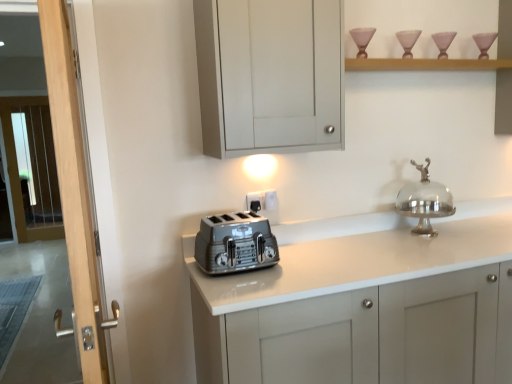
Describe the element at coordinates (255, 201) in the screenshot. I see `matte black outlet at center, the second electric outlet when ordered from right to left` at that location.

Locate an element on the screen. This screenshot has width=512, height=384. matte black outlet at center, the second electric outlet when ordered from right to left is located at coordinates (255, 201).

What is the approximate height of white glossy countertop at center?

The height of white glossy countertop at center is 39.06 inches.

Image resolution: width=512 pixels, height=384 pixels. What do you see at coordinates (360, 255) in the screenshot?
I see `white glossy countertop at center` at bounding box center [360, 255].

The height and width of the screenshot is (384, 512). Find the location of `white plastic electric outlet at center, marked as the 2th electric outlet in a left-to-right arrangement`. white plastic electric outlet at center, marked as the 2th electric outlet in a left-to-right arrangement is located at coordinates (271, 201).

Identify the location of wooden screen door at left, the second screen door in the back-to-front sequence. This screenshot has width=512, height=384. (75, 190).

Where is `matte black outlet at center, acting as the first electric outlet starting from the left`? The width and height of the screenshot is (512, 384). matte black outlet at center, acting as the first electric outlet starting from the left is located at coordinates (255, 201).

Looking at this image, from a real-world perspective, who is located higher, matte black outlet at center, acting as the first electric outlet starting from the left, or matte gray cabinet at upper center?

matte gray cabinet at upper center is physically above.

Can you tell me how much matte black outlet at center, acting as the first electric outlet starting from the left, and matte gray cabinet at upper center differ in facing direction?

The facing directions of matte black outlet at center, acting as the first electric outlet starting from the left, and matte gray cabinet at upper center are 0.00234 degrees apart.

Does point (255, 211) come behind point (319, 94)?

Yes.

Does matte black outlet at center, the second electric outlet when ordered from right to left, touch matte gray cabinet at upper center?

matte black outlet at center, the second electric outlet when ordered from right to left, is not next to matte gray cabinet at upper center, and they're not touching.

Is clear glass screen door at left, placed as the 1th screen door when sorted from left to right, looking in the opposite direction of white glossy countertop at center?

clear glass screen door at left, placed as the 1th screen door when sorted from left to right, is not turned away from white glossy countertop at center.

Looking at the image, does clear glass screen door at left, which is the 1th screen door in back-to-front order, seem bigger or smaller compared to white glossy countertop at center?

Clearly, clear glass screen door at left, which is the 1th screen door in back-to-front order, is smaller in size than white glossy countertop at center.

Consider the image. Does clear glass screen door at left, placed as the 1th screen door when sorted from left to right, have a lesser width compared to white glossy countertop at center?

Indeed, clear glass screen door at left, placed as the 1th screen door when sorted from left to right, has a lesser width compared to white glossy countertop at center.

Identify the location of screen door that appears behind the silver metallic cake stand at upper right. Image resolution: width=512 pixels, height=384 pixels. (33, 169).

Considering their positions, is silver metallic cake stand at upper right located in front of or behind clear glass screen door at left, the second screen door when ordered from right to left?

silver metallic cake stand at upper right is in front of clear glass screen door at left, the second screen door when ordered from right to left.

Is silver metallic cake stand at upper right directly adjacent to clear glass screen door at left, which is the 1th screen door in back-to-front order?

No.

In the image, is silver metallic cake stand at upper right on the left side or the right side of clear glass screen door at left, placed as the 1th screen door when sorted from left to right?

Based on their positions, silver metallic cake stand at upper right is located to the right of clear glass screen door at left, placed as the 1th screen door when sorted from left to right.

Considering the positions of objects satin silver toaster at center and matte gray cabinet at upper center in the image provided, who is in front, satin silver toaster at center or matte gray cabinet at upper center?

matte gray cabinet at upper center is in front.

Considering the relative sizes of satin silver toaster at center and matte gray cabinet at upper center in the image provided, is satin silver toaster at center shorter than matte gray cabinet at upper center?

Correct, satin silver toaster at center is not as tall as matte gray cabinet at upper center.

Identify the location of home appliance directly beneath the matte gray cabinet at upper center (from a real-world perspective). (234, 243).

Who is bigger, satin silver toaster at center or matte gray cabinet at upper center?

Bigger between the two is matte gray cabinet at upper center.

Could you measure the distance between wooden shelf at upper center and matte black outlet at center, the second electric outlet when ordered from right to left?

They are 3.29 feet apart.

From the picture: Can you confirm if wooden shelf at upper center is shorter than matte black outlet at center, the second electric outlet when ordered from right to left?

Correct, wooden shelf at upper center is not as tall as matte black outlet at center, the second electric outlet when ordered from right to left.

Which of these two, wooden shelf at upper center or matte black outlet at center, the second electric outlet when ordered from right to left, is thinner?

matte black outlet at center, the second electric outlet when ordered from right to left, is thinner.

Is satin silver toaster at center in front of or behind clear glass screen door at left, which is the 1th screen door in back-to-front order, in the image?

Visually, satin silver toaster at center is located in front of clear glass screen door at left, which is the 1th screen door in back-to-front order.

Image resolution: width=512 pixels, height=384 pixels. I want to click on screen door behind the satin silver toaster at center, so click(33, 169).

Is satin silver toaster at center inside the boundaries of clear glass screen door at left, the 2th screen door from the front, or outside?

satin silver toaster at center is spatially situated outside clear glass screen door at left, the 2th screen door from the front.

Is satin silver toaster at center thinner than clear glass screen door at left, which is the 1th screen door in back-to-front order?

In fact, satin silver toaster at center might be wider than clear glass screen door at left, which is the 1th screen door in back-to-front order.

From the image's perspective, is clear glass screen door at left, the 2th screen door from the front, on satin silver toaster at center?

Yes, from the image's perspective, clear glass screen door at left, the 2th screen door from the front, is above satin silver toaster at center.

Between clear glass screen door at left, placed as the 1th screen door when sorted from left to right, and satin silver toaster at center, which one is positioned in front?

satin silver toaster at center is more forward.

Is clear glass screen door at left, the 2th screen door from the front, oriented towards satin silver toaster at center?

No, clear glass screen door at left, the 2th screen door from the front, is not turned towards satin silver toaster at center.

Which electric outlet is the 2nd one when counting from the back of the matte gray cabinet at upper center? Please provide its 2D coordinates.

[(255, 201)]

Image resolution: width=512 pixels, height=384 pixels. Find the location of `countertop in front of the clear glass screen door at left, which is the 1th screen door in back-to-front order`. countertop in front of the clear glass screen door at left, which is the 1th screen door in back-to-front order is located at coordinates (360, 255).

Considering their positions, is silver metallic cake stand at upper right positioned further to white glossy countertop at center than wooden shelf at upper center?

wooden shelf at upper center.

Based on their spatial positions, is wooden shelf at upper center or clear glass screen door at left, the second screen door when ordered from right to left, further from matte gray cabinet at upper center?

The object further to matte gray cabinet at upper center is clear glass screen door at left, the second screen door when ordered from right to left.

Which object lies further to the anchor point wooden screen door at left, the second screen door in the back-to-front sequence, satin silver toaster at center or matte black outlet at center, the second electric outlet when ordered from right to left?

matte black outlet at center, the second electric outlet when ordered from right to left, lies further to wooden screen door at left, the second screen door in the back-to-front sequence, than the other object.

Estimate the real-world distances between objects in this image. Which object is further from wooden screen door at left, the second screen door from the left, white plastic electric outlet at center, marked as the 2th electric outlet in a left-to-right arrangement, or satin silver toaster at center?

white plastic electric outlet at center, marked as the 2th electric outlet in a left-to-right arrangement, is positioned further to the anchor wooden screen door at left, the second screen door from the left.

Which object lies nearer to the anchor point white glossy countertop at center, clear glass screen door at left, which is the 1th screen door in back-to-front order, or white plastic electric outlet at center, marked as the 1th electric outlet in a right-to-left arrangement?

The object closer to white glossy countertop at center is white plastic electric outlet at center, marked as the 1th electric outlet in a right-to-left arrangement.

Considering their positions, is matte gray cabinet at upper center positioned further to silver metallic cake stand at upper right than white plastic electric outlet at center, marked as the 2th electric outlet in a left-to-right arrangement?

Among the two, matte gray cabinet at upper center is located further to silver metallic cake stand at upper right.

From the image, which object appears to be nearer to white plastic electric outlet at center, marked as the 2th electric outlet in a left-to-right arrangement, wooden screen door at left, arranged as the first screen door when viewed from the front, or matte black outlet at center, the second electric outlet when ordered from right to left?

matte black outlet at center, the second electric outlet when ordered from right to left, is closer to white plastic electric outlet at center, marked as the 2th electric outlet in a left-to-right arrangement.

Estimate the real-world distances between objects in this image. Which object is closer to matte gray cabinet at upper center, wooden screen door at left, the 1th screen door positioned from the right, or wooden shelf at upper center?

The object closer to matte gray cabinet at upper center is wooden shelf at upper center.

Image resolution: width=512 pixels, height=384 pixels. I want to click on appliance situated between white plastic electric outlet at center, marked as the 2th electric outlet in a left-to-right arrangement, and wooden shelf at upper center from left to right, so click(x=424, y=201).

You are a GUI agent. You are given a task and a screenshot of the screen. Output one action in this format:
    pyautogui.click(x=<x>, y=<y>)
    Task: Click on the electric outlet between satin silver toaster at center and matte black outlet at center, the second electric outlet when ordered from right to left, from front to back
    The image size is (512, 384).
    Given the screenshot: What is the action you would take?
    pyautogui.click(x=271, y=201)

I want to click on countertop located between wooden screen door at left, the second screen door from the left, and clear glass screen door at left, the second screen door when ordered from right to left, in the depth direction, so click(360, 255).

Identify the location of appliance between matte gray cabinet at upper center and white glossy countertop at center in the vertical direction. (424, 201).